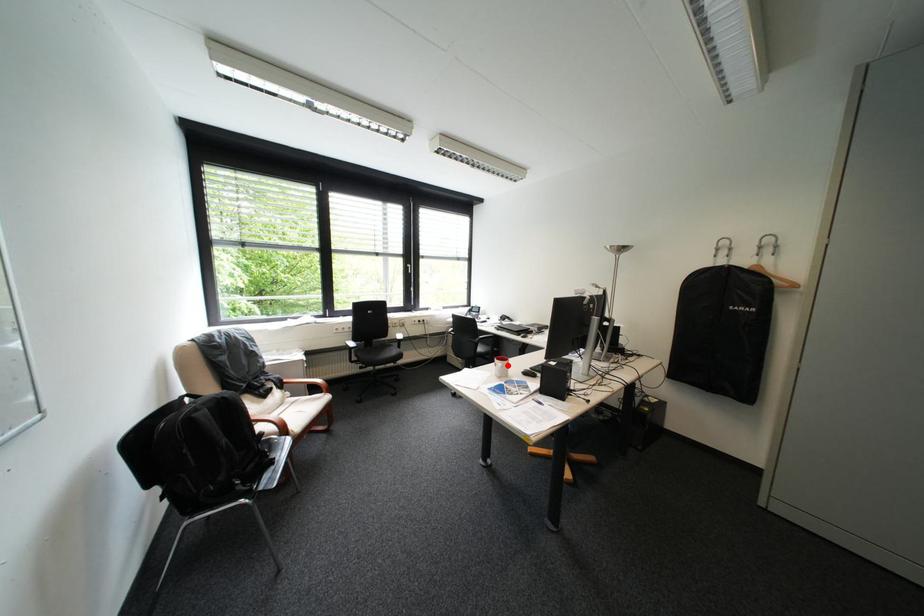
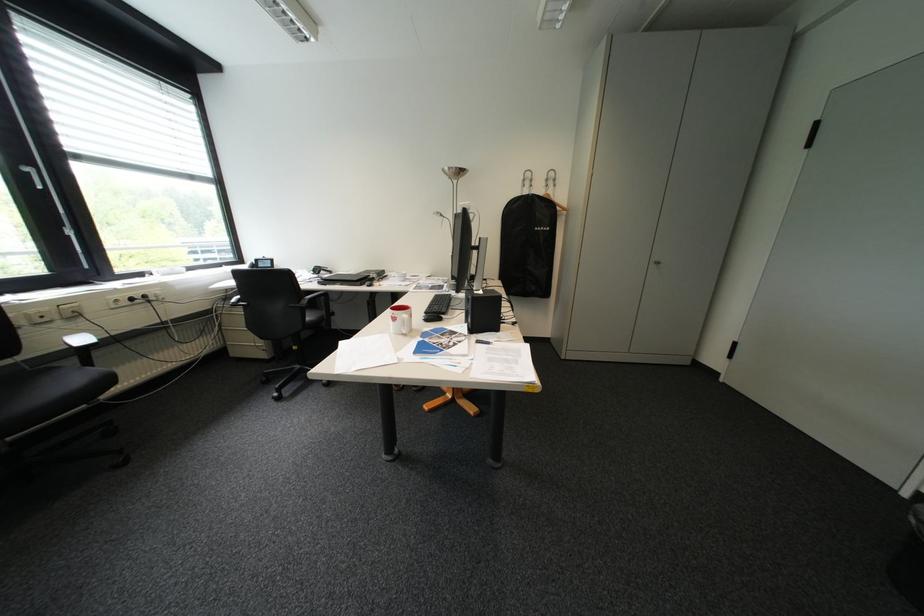
Question: A red point is marked in image1. In image2, is the corresponding 3D point closer to the camera or farther? Reply with the corresponding letter.

Choices:
 (A) The corresponding 3D point is closer.
 (B) The corresponding 3D point is farther.

Answer: (B)